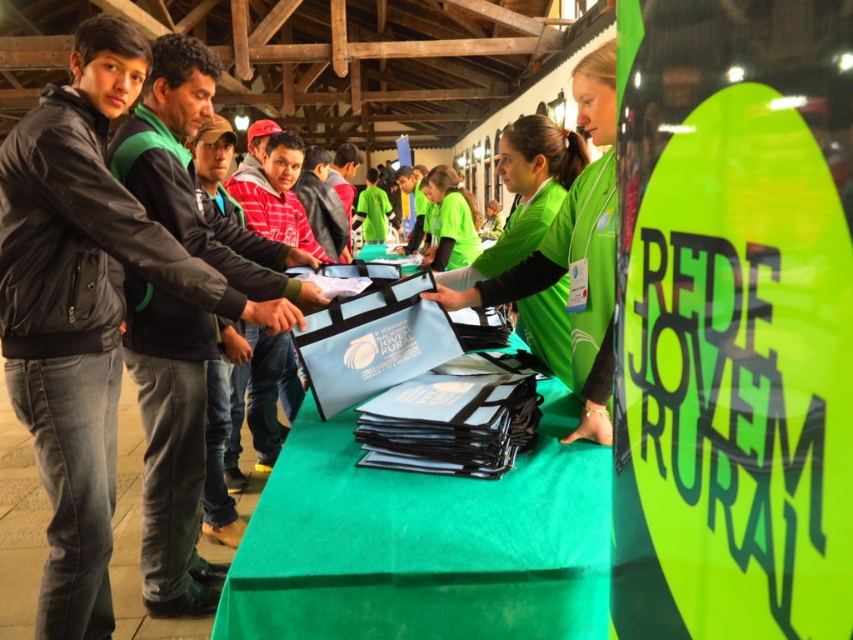
Question: Which point is closer to the camera?

Choices:
 (A) (155, 131)
 (B) (584, 257)
 (C) (424, 198)

Answer: (B)

Question: Which of these objects is positioned closest to the green fleece jacket at left?

Choices:
 (A) green matte vest at center
 (B) green fabric shirt at center

Answer: (A)

Question: Does green fleece jacket at left have a larger size compared to green fabric shirt at center?

Choices:
 (A) yes
 (B) no

Answer: (B)

Question: Is green fleece jacket at left bigger than green fabric shirt at center?

Choices:
 (A) no
 (B) yes

Answer: (A)

Question: Which of the following is the farthest from the observer?

Choices:
 (A) (496, 284)
 (B) (415, 173)

Answer: (B)

Question: Is green fleece jacket at left to the left of green matte vest at center from the viewer's perspective?

Choices:
 (A) no
 (B) yes

Answer: (B)